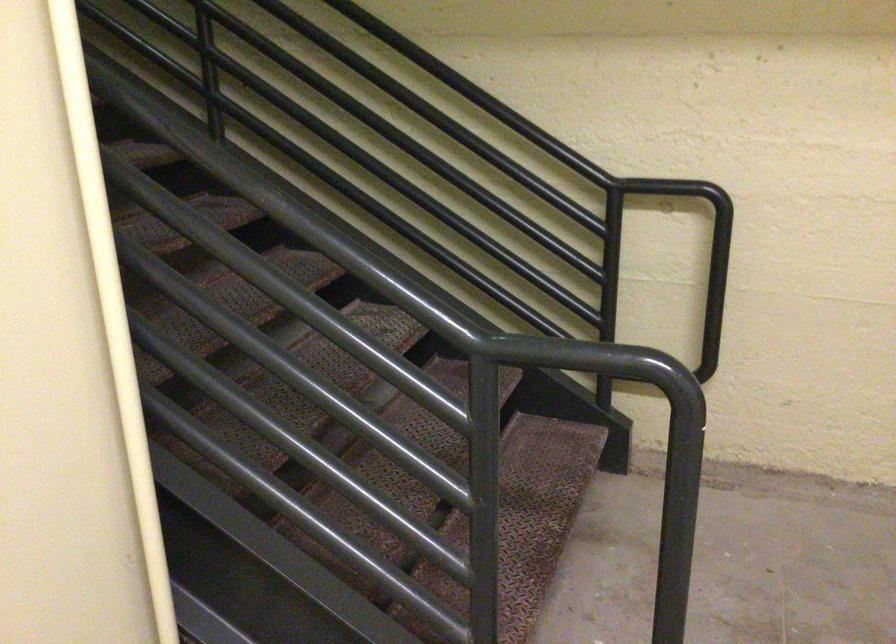
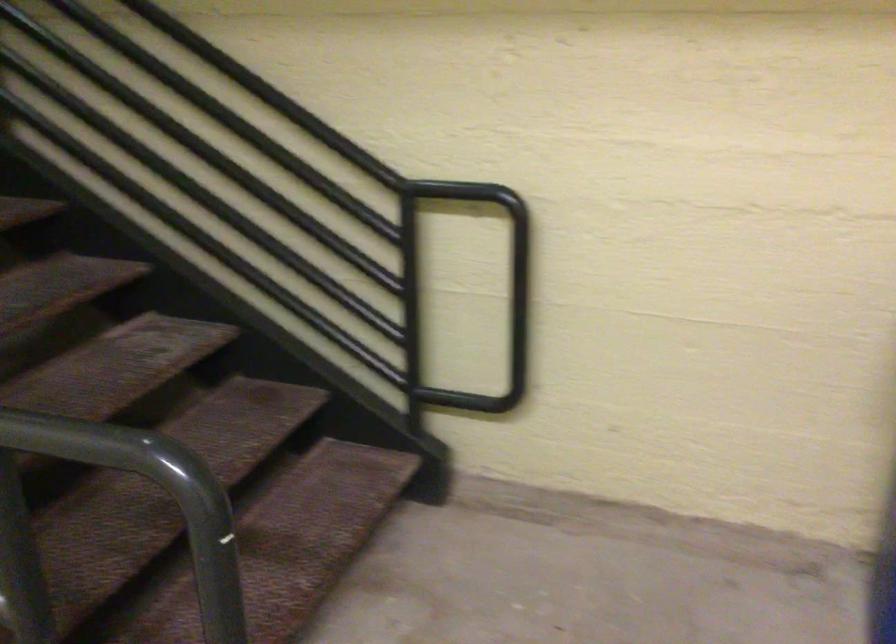
The point at (x=480, y=96) is marked in the first image. Where is the corresponding point in the second image?

(265, 91)